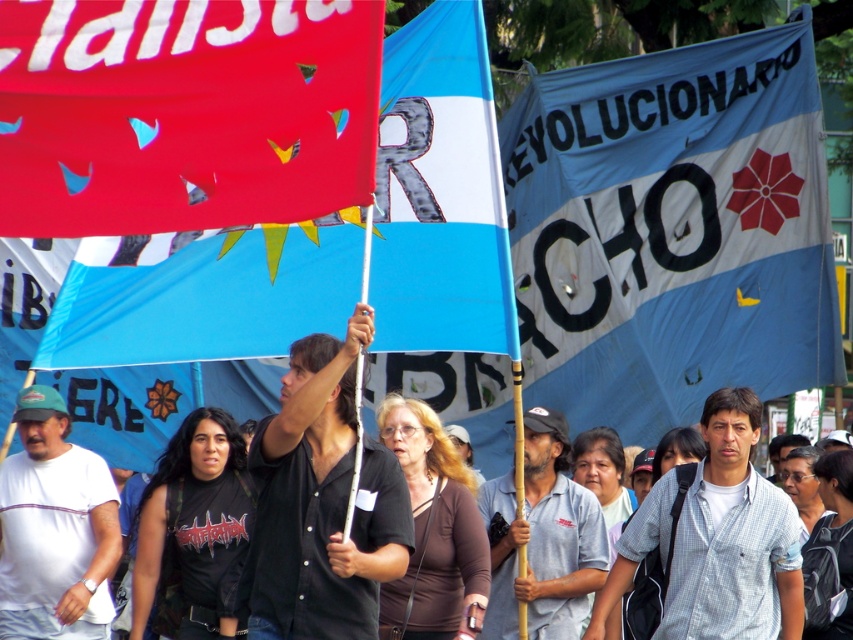
You are a photographer trying to capture the protest scene. You notice the gray checkered shirt at center and the black fabric crowd at center. Which object is narrower in width?

The gray checkered shirt at center is narrower in width compared to the black fabric crowd at center.

You are a photographer trying to capture the matte plastic flag at upper center and the gray checkered shirt at center in the same frame. Can you position yourself so that both are visible without one blocking the other?

The matte plastic flag at upper center is in front of the gray checkered shirt at center, so you cannot position yourself to see both without one blocking the other.

You are a photographer trying to capture the matte plastic flag at upper center in the protest scene. Based on its 2D coordinates, where should you position your camera to ensure it is centered in the frame?

To center the matte plastic flag at upper center in the frame, position your camera so that the flag is at the coordinates point (440, 193).